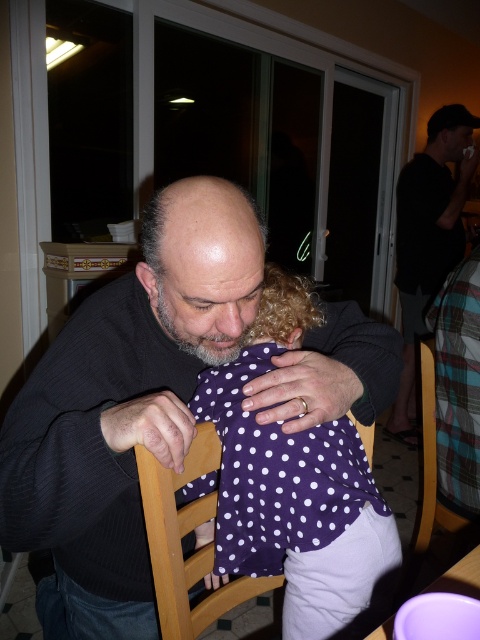
Question: Estimate the real-world distances between objects in this image. Which object is closer to the black sweater at center?

Choices:
 (A) matte black sweater at center
 (B) wooden chair at lower center
 (C) purple dotted fabric at center

Answer: (C)

Question: Does wooden chair at lower center appear on the left side of yellow plastic chair at right?

Choices:
 (A) yes
 (B) no

Answer: (A)

Question: Can you confirm if matte black sweater at center is smaller than purple dotted fabric at center?

Choices:
 (A) yes
 (B) no

Answer: (B)

Question: Which point is closer to the camera?

Choices:
 (A) (421, 266)
 (B) (368, 637)

Answer: (B)

Question: Which object appears farthest from the camera in this image?

Choices:
 (A) matte black sweater at center
 (B) black sweater at center

Answer: (B)

Question: Is black sweater at center further to camera compared to wooden chair at lower center?

Choices:
 (A) no
 (B) yes

Answer: (B)